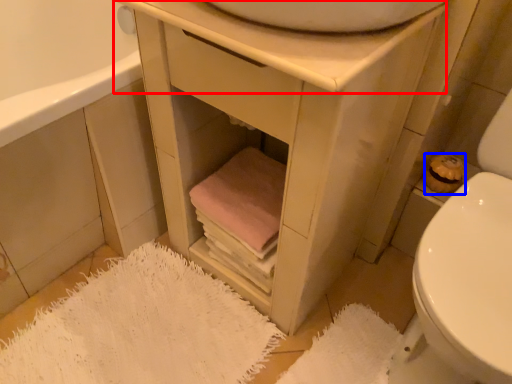
Question: Which of the following is the farthest to the observer, counter top (highlighted by a red box) or toilet paper (highlighted by a blue box)?

Choices:
 (A) counter top
 (B) toilet paper

Answer: (B)